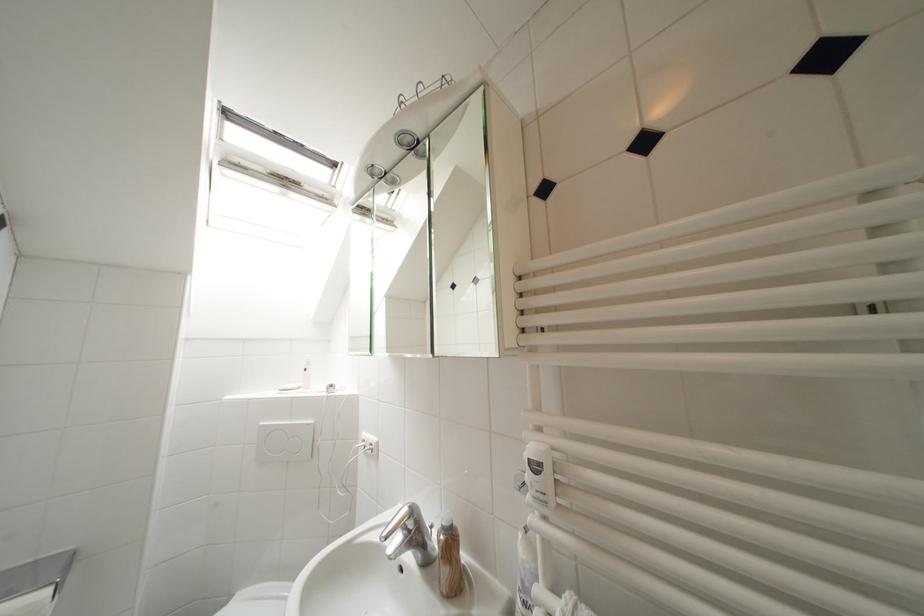
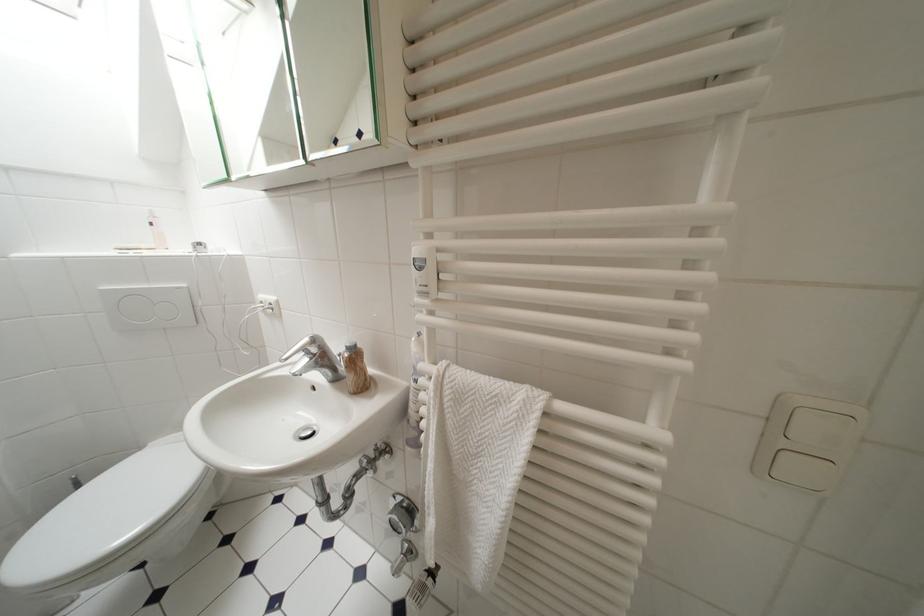
Question: In a continuous first-person perspective shot, in which direction is the camera moving?

Choices:
 (A) Left
 (B) Right
 (C) Forward
 (D) Backward

Answer: (B)